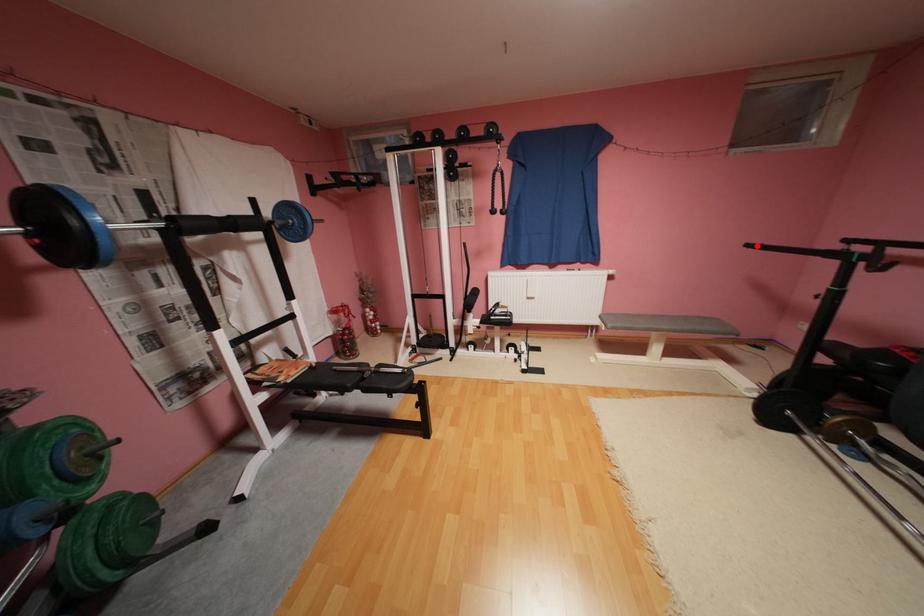
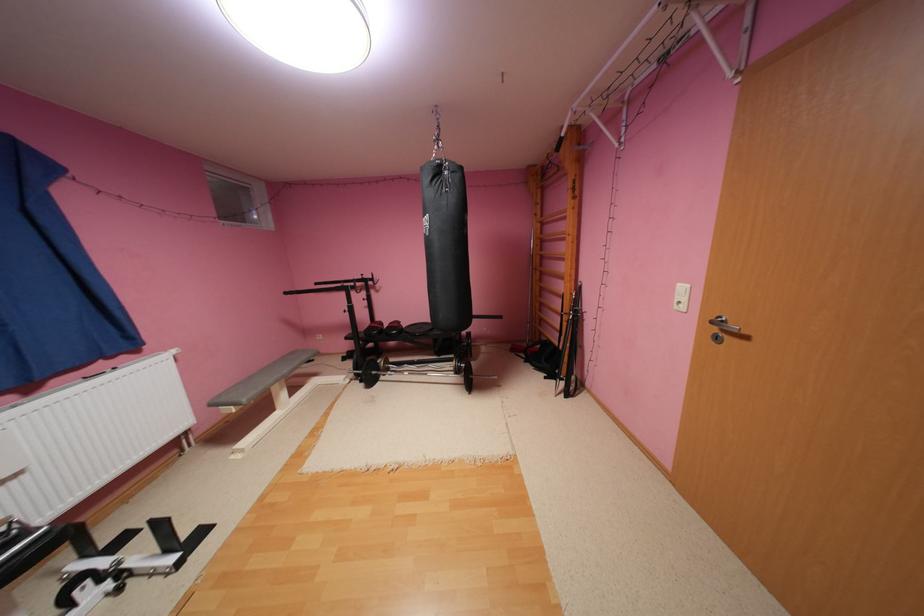
The point at the highlighted location is marked in the first image. Where is the corresponding point in the second image?

(295, 293)